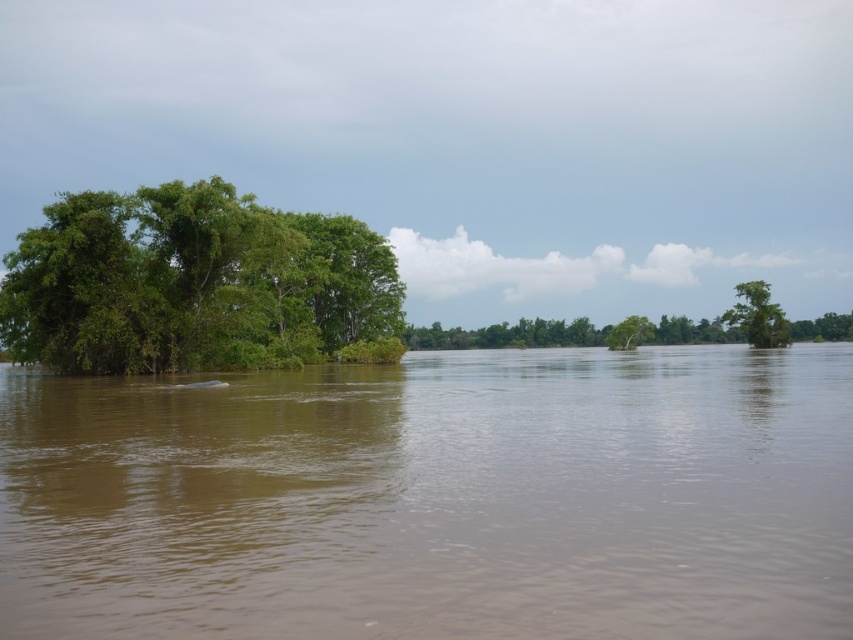
Question: Which point appears closest to the camera in this image?

Choices:
 (A) (618, 332)
 (B) (321, 330)
 (C) (82, 397)
 (D) (730, 317)

Answer: (C)

Question: Does brown muddy water at center have a smaller size compared to green leafy tree at left?

Choices:
 (A) yes
 (B) no

Answer: (A)

Question: Can you confirm if green leafy tree at left is thinner than green leafy tree at center?

Choices:
 (A) yes
 (B) no

Answer: (B)

Question: Based on their relative distances, which object is farther from the green leafy tree at center?

Choices:
 (A) green leafy tree at left
 (B) brown muddy water at center

Answer: (B)

Question: Can you confirm if green leafy tree at right is positioned above green leafy tree at center?

Choices:
 (A) no
 (B) yes

Answer: (A)

Question: Which object is positioned closest to the brown muddy water at center?

Choices:
 (A) green leafy tree at right
 (B) green leafy tree at left

Answer: (B)